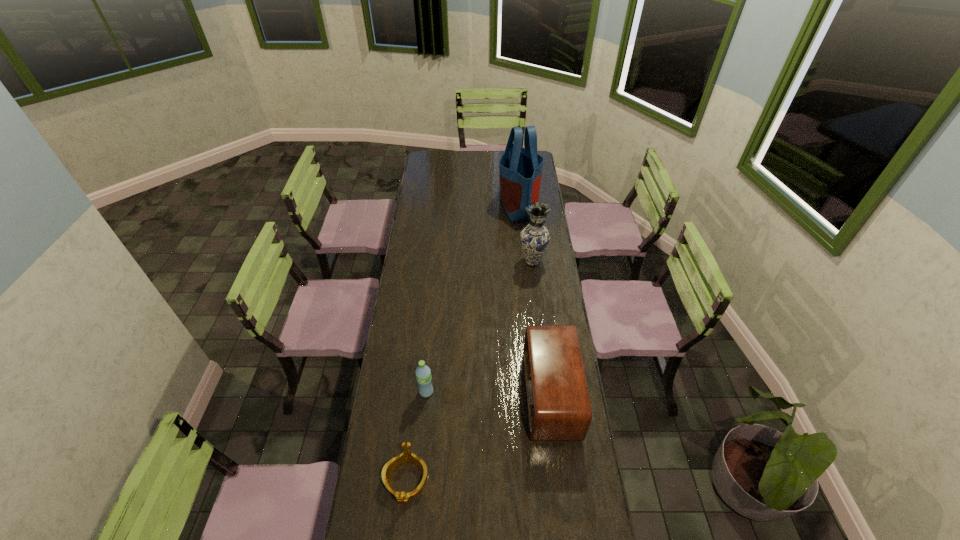
I want to click on free region located on the front panel of the radio receiver, so click(459, 395).

Locate an element on the screen. The image size is (960, 540). vacant area situated 0.310m on the front panel of the radio receiver is located at coordinates (443, 395).

This screenshot has height=540, width=960. Find the location of `free location located on the front panel of the radio receiver`. free location located on the front panel of the radio receiver is located at coordinates coord(448,395).

The image size is (960, 540). I want to click on blank area located on the back of the water bottle, so click(432, 328).

The width and height of the screenshot is (960, 540). Find the location of `vacant point located 0.070m at the front emblem of the tiara`. vacant point located 0.070m at the front emblem of the tiara is located at coordinates (400, 535).

Locate an element on the screen. This screenshot has width=960, height=540. water bottle that is at the left edge is located at coordinates (423, 373).

This screenshot has width=960, height=540. I want to click on tiara that is at the left edge, so click(407, 456).

At what (x,y) coordinates should I click in order to perform the action: click on handbag at the right edge. Please return your answer as a coordinate pair (x, y). Looking at the image, I should click on (520, 168).

You are a GUI agent. You are given a task and a screenshot of the screen. Output one action in this format:
    pyautogui.click(x=<x>, y=<y>)
    Task: Click on the vase at the right edge
    Image resolution: width=960 pixels, height=540 pixels.
    Given the screenshot: What is the action you would take?
    pyautogui.click(x=535, y=238)

Locate an element on the screen. radio receiver that is at the right edge is located at coordinates (559, 409).